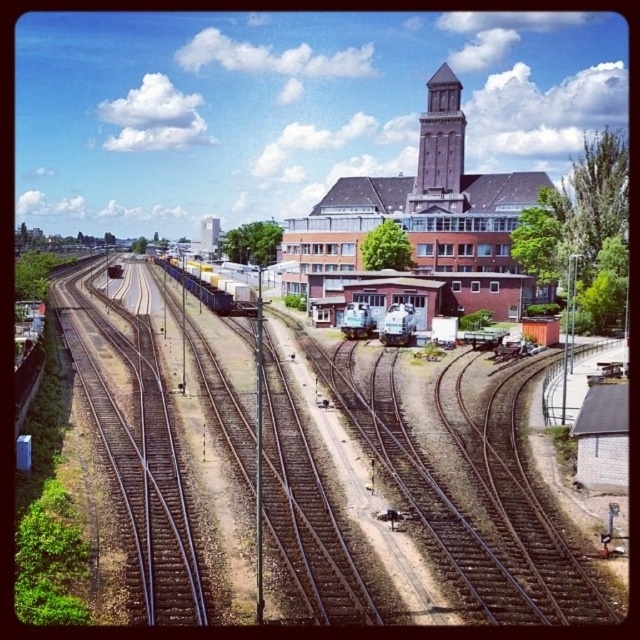
Who is positioned more to the left, yellow matte train carriages at center or green metallic train at center?

From the viewer's perspective, yellow matte train carriages at center appears more on the left side.

Is point (193, 284) positioned before point (346, 337)?

No, it is not.

Which is behind, point (211, 298) or point (342, 324)?

The point (211, 298) is behind.

Identify the location of yellow matte train carriages at center. The image size is (640, 640). (205, 291).

Which is in front, point (451, 593) or point (364, 316)?

Point (451, 593) is more forward.

Describe the element at coordinates (410, 496) in the screenshot. I see `brown metal tracks at center` at that location.

You are a GUI agent. You are given a task and a screenshot of the screen. Output one action in this format:
    pyautogui.click(x=<x>, y=<y>)
    Task: Click on the brown metal tracks at center
    
    Given the screenshot: What is the action you would take?
    pyautogui.click(x=410, y=496)

Does yellow matte train carriages at center have a greater height compared to silver metallic train at center?

Correct, yellow matte train carriages at center is much taller as silver metallic train at center.

Which is in front, point (172, 266) or point (397, 314)?

Positioned in front is point (397, 314).

What are the coordinates of `yellow matte train carriages at center` in the screenshot? It's located at (205, 291).